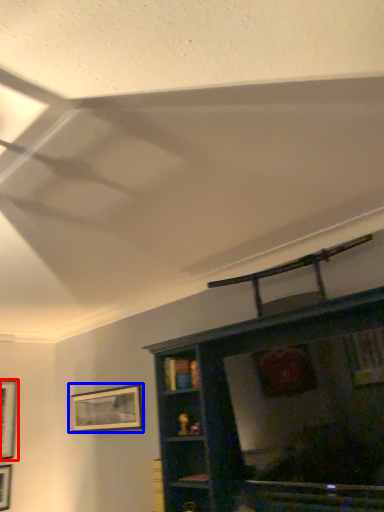
Question: Which object appears closest to the camera in this image, picture frame (highlighted by a red box) or picture frame (highlighted by a blue box)?

Choices:
 (A) picture frame
 (B) picture frame

Answer: (B)